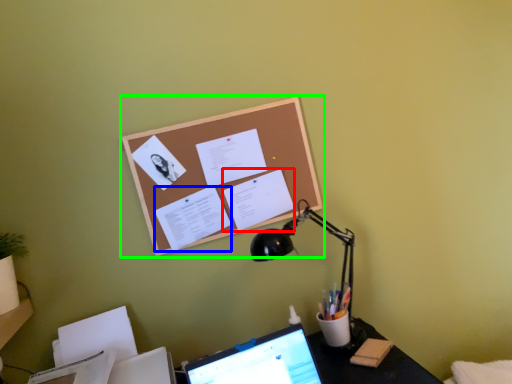
Question: Based on their relative distances, which object is farther from document (highlighted by a red box)? Choose from document (highlighted by a blue box) and bulletin board (highlighted by a green box).

Choices:
 (A) document
 (B) bulletin board

Answer: (A)